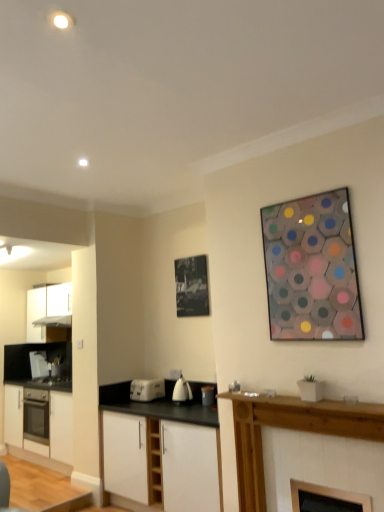
Question: Can you confirm if satin silver exhaust hood at left is thinner than white plastic toaster at left, marked as the 1th appliance in a back-to-front arrangement?

Choices:
 (A) no
 (B) yes

Answer: (A)

Question: Is satin silver exhaust hood at left far from white plastic toaster at left, marked as the 1th appliance in a back-to-front arrangement?

Choices:
 (A) yes
 (B) no

Answer: (A)

Question: From a real-world perspective, is satin silver exhaust hood at left beneath white plastic toaster at left, the 3th appliance positioned from the front?

Choices:
 (A) no
 (B) yes

Answer: (A)

Question: Is satin silver exhaust hood at left taller than white plastic toaster at left, the 3th appliance positioned from the front?

Choices:
 (A) no
 (B) yes

Answer: (A)

Question: Is satin silver exhaust hood at left beside white plastic toaster at left, the third appliance from the right?

Choices:
 (A) no
 (B) yes

Answer: (A)

Question: From the image's perspective, is white plastic toaster at left, the 3th appliance positioned from the front, positioned above or below white matte cabinet at left, placed as the second cabinetry when sorted from back to front?

Choices:
 (A) below
 (B) above

Answer: (B)

Question: Looking at their shapes, would you say white plastic toaster at left, marked as the 1th appliance in a left-to-right arrangement, is wider or thinner than white matte cabinet at left, which is the third cabinetry from front to back?

Choices:
 (A) wide
 (B) thin

Answer: (B)

Question: Considering the relative positions of white plastic toaster at left, marked as the 1th appliance in a left-to-right arrangement, and white matte cabinet at left, which is counted as the 1th cabinetry, starting from the left, in the image provided, is white plastic toaster at left, marked as the 1th appliance in a left-to-right arrangement, to the left or to the right of white matte cabinet at left, which is counted as the 1th cabinetry, starting from the left,?

Choices:
 (A) left
 (B) right

Answer: (A)

Question: From a real-world perspective, is white plastic toaster at left, the 3th appliance positioned from the front, above or below white matte cabinet at left, placed as the second cabinetry when sorted from back to front?

Choices:
 (A) above
 (B) below

Answer: (A)

Question: Is white matte cabinet at lower center, acting as the third cabinetry starting from the back, spatially inside white glossy kettle at center, acting as the first kitchen appliance starting from the front, or outside of it?

Choices:
 (A) inside
 (B) outside

Answer: (B)

Question: Based on their positions, is white matte cabinet at lower center, acting as the third cabinetry starting from the back, located to the left or right of white glossy kettle at center, acting as the first kitchen appliance starting from the front?

Choices:
 (A) left
 (B) right

Answer: (A)

Question: From a real-world perspective, is white matte cabinet at lower center, acting as the third cabinetry starting from the back, physically located above or below white glossy kettle at center, the 2th kitchen appliance positioned from the back?

Choices:
 (A) above
 (B) below

Answer: (B)

Question: Looking at their shapes, would you say white matte cabinet at lower center, which ranks as the 3th cabinetry in left-to-right order, is wider or thinner than white glossy kettle at center, positioned as the 2th kitchen appliance in left-to-right order?

Choices:
 (A) wide
 (B) thin

Answer: (A)

Question: Does point (x=69, y=321) appear closer or farther from the camera than point (x=145, y=392)?

Choices:
 (A) farther
 (B) closer

Answer: (A)

Question: In the image, is satin silver exhaust hood at left positioned in front of or behind white plastic toaster at lower center, placed as the 2th kitchen appliance when sorted from front to back?

Choices:
 (A) behind
 (B) front

Answer: (A)